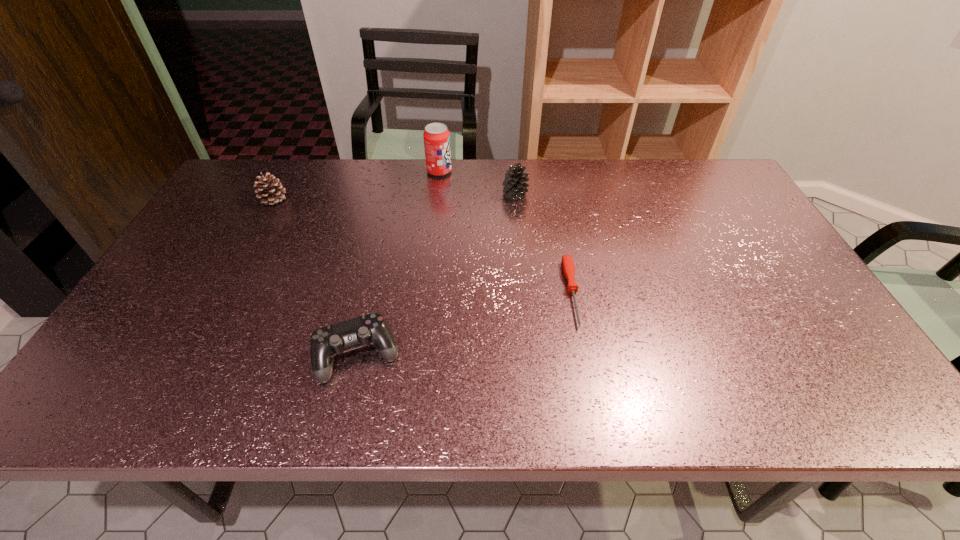
At what (x,y) coordinates should I click in order to perform the action: click on vacant region at the left edge of the desktop. Please return your answer as a coordinate pair (x, y). Image resolution: width=960 pixels, height=540 pixels. Looking at the image, I should click on (167, 315).

You are a GUI agent. You are given a task and a screenshot of the screen. Output one action in this format:
    pyautogui.click(x=<x>, y=<y>)
    Task: Click on the vacant space at the right edge of the desktop
    The height and width of the screenshot is (540, 960).
    Given the screenshot: What is the action you would take?
    pyautogui.click(x=775, y=297)

Find the location of a particular element. The image size is (960, 540). free spot between the second shortest object and the second tallest object is located at coordinates (437, 274).

What are the coordinates of `free space that is in between the screwdriver and the control` in the screenshot? It's located at (465, 323).

Image resolution: width=960 pixels, height=540 pixels. In order to click on free space between the left pinecone and the tallest object in this screenshot , I will do `click(356, 186)`.

Image resolution: width=960 pixels, height=540 pixels. Identify the location of free area in between the shortest object and the right pinecone. (543, 244).

You are a GUI agent. You are given a task and a screenshot of the screen. Output one action in this format:
    pyautogui.click(x=<x>, y=<y>)
    Task: Click on the vacant region between the taller pinecone and the rightmost object
    The height and width of the screenshot is (540, 960).
    Given the screenshot: What is the action you would take?
    click(x=543, y=244)

Identify the location of free space between the control and the soda can. (398, 263).

At what (x,y) coordinates should I click in order to perform the action: click on free spot between the fourth shortest object and the tallest object. Please return your answer as a coordinate pair (x, y). This screenshot has height=540, width=960. Looking at the image, I should click on (477, 183).

Identify the location of free spot between the rightmost object and the tallest object. This screenshot has width=960, height=540. (506, 232).